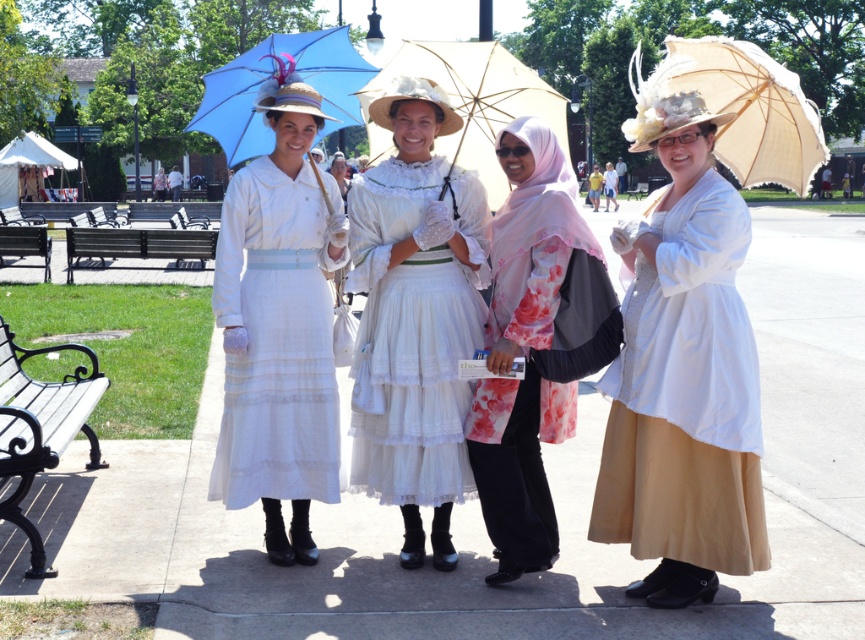
Looking at this image, you are a photographer trying to capture a clear shot of the black metal bench at left. However, the matte blue fabric umbrella at upper left is blocking your view. Can you move the umbrella to the side to get an unobstructed view of the bench?

The matte blue fabric umbrella at upper left is in front of the black metal bench at left, so moving it to the side would allow you to see the bench clearly.

Which object is located at the coordinates point (279, 324)?

The point (279, 324) is located on the matte white dress at center.